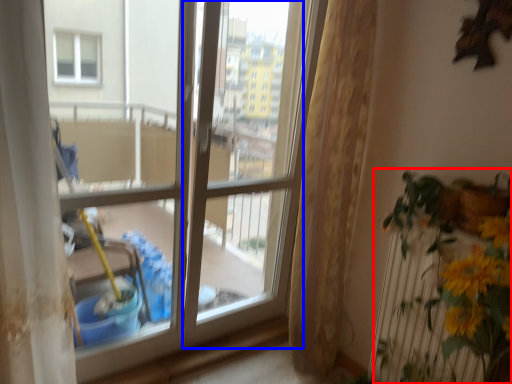
Question: Which object appears farthest to the camera in this image, houseplant (highlighted by a red box) or screen door (highlighted by a blue box)?

Choices:
 (A) houseplant
 (B) screen door

Answer: (B)